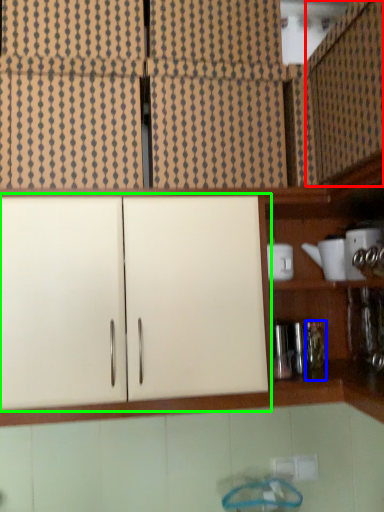
Question: Which object is positioned closest to cabinetry (highlighted by a red box)? Select from bottle (highlighted by a blue box) and cabinetry (highlighted by a green box).

Choices:
 (A) bottle
 (B) cabinetry

Answer: (B)